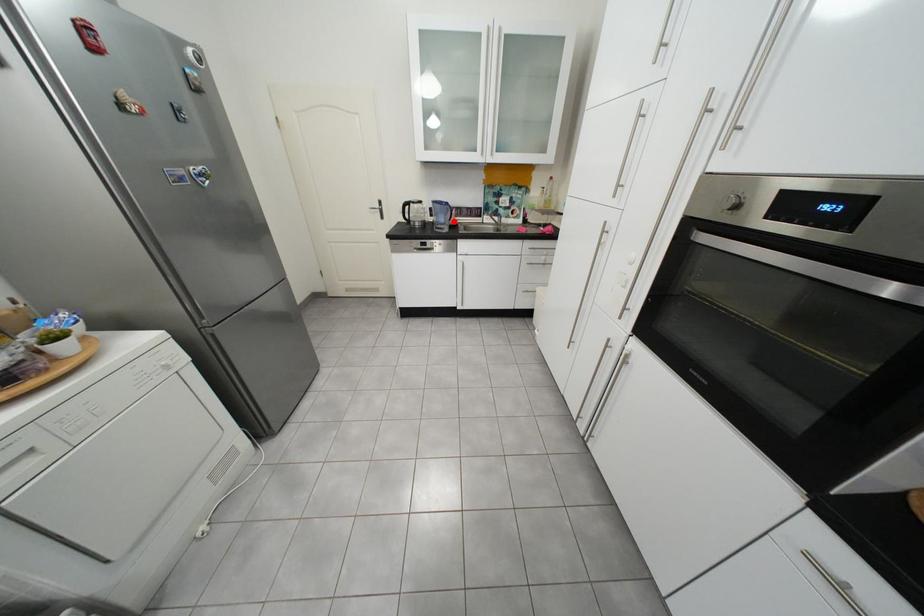
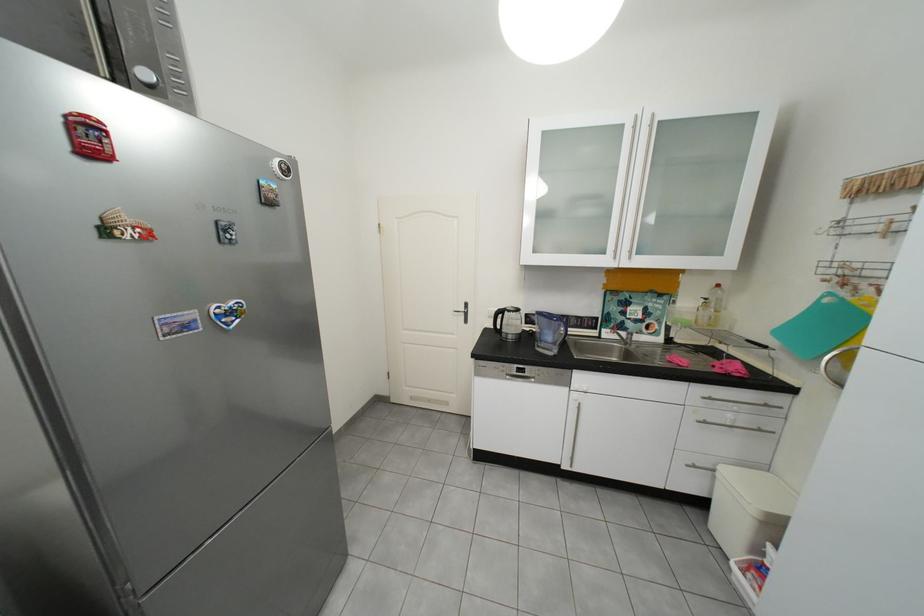
In the second image, find the point that corresponds to the highlighted location in the first image.

(561, 339)